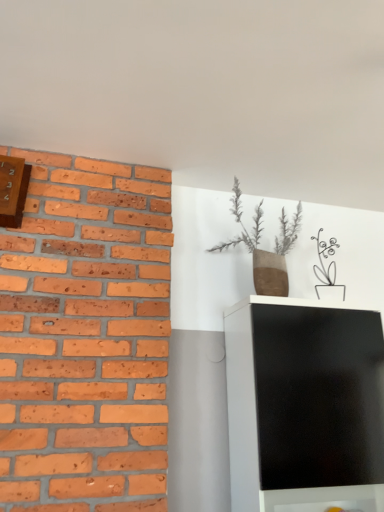
This screenshot has height=512, width=384. What do you see at coordinates (263, 250) in the screenshot?
I see `brown textured vase at upper center` at bounding box center [263, 250].

In order to click on brown textured vase at upper center in this screenshot , I will do `click(263, 250)`.

The height and width of the screenshot is (512, 384). I want to click on wooden clock at upper left, so point(13,190).

What is the approximate width of wooden clock at upper left?

The width of wooden clock at upper left is 3.53 inches.

This screenshot has width=384, height=512. Describe the element at coordinates (13, 190) in the screenshot. I see `wooden clock at upper left` at that location.

What are the coordinates of `brown textured vase at upper center` in the screenshot? It's located at (263, 250).

Which object is positioned more to the left, wooden clock at upper left or brown textured vase at upper center?

Positioned to the left is wooden clock at upper left.

Which object is further away from the camera, wooden clock at upper left or brown textured vase at upper center?

brown textured vase at upper center is further from the camera.

Based on the photo, which point is more distant from viewer, (6, 200) or (250, 241)?

Positioned behind is point (250, 241).

From the image's perspective, is wooden clock at upper left located beneath brown textured vase at upper center?

No, from the image's perspective, wooden clock at upper left is not beneath brown textured vase at upper center.

From a real-world perspective, is wooden clock at upper left under brown textured vase at upper center?

Incorrect, from a real-world perspective, wooden clock at upper left is higher than brown textured vase at upper center.

Considering the sizes of objects wooden clock at upper left and brown textured vase at upper center in the image provided, who is thinner, wooden clock at upper left or brown textured vase at upper center?

Thinner between the two is wooden clock at upper left.

From their relative heights in the image, would you say wooden clock at upper left is taller or shorter than brown textured vase at upper center?

Clearly, wooden clock at upper left is shorter compared to brown textured vase at upper center.

Can you confirm if wooden clock at upper left is bigger than brown textured vase at upper center?

Actually, wooden clock at upper left might be smaller than brown textured vase at upper center.

Is wooden clock at upper left spatially inside brown textured vase at upper center, or outside of it?

wooden clock at upper left is outside brown textured vase at upper center.

Are wooden clock at upper left and brown textured vase at upper center making contact?

No, wooden clock at upper left is not touching brown textured vase at upper center.

Could you tell me if wooden clock at upper left is turned towards brown textured vase at upper center?

No, wooden clock at upper left does not turn towards brown textured vase at upper center.

How distant is wooden clock at upper left from brown textured vase at upper center?

They are 3.39 feet apart.

Locate an element on the screen. clock above the brown textured vase at upper center (from the image's perspective) is located at coordinates (13, 190).

Considering the relative positions of brown textured vase at upper center and wooden clock at upper left in the image provided, is brown textured vase at upper center to the left of wooden clock at upper left from the viewer's perspective?

No.

Is the depth of brown textured vase at upper center greater than that of wooden clock at upper left?

That is True.

Which is nearer, [277,261] or [0,159]?

Point [277,261] is farther from the camera than point [0,159].

From the image's perspective, would you say brown textured vase at upper center is shown under wooden clock at upper left?

Yes, from the image's perspective, brown textured vase at upper center is beneath wooden clock at upper left.

From a real-world perspective, which is physically above, brown textured vase at upper center or wooden clock at upper left?

wooden clock at upper left, from a real-world perspective.

Which object is wider, brown textured vase at upper center or wooden clock at upper left?

With larger width is brown textured vase at upper center.

Can you confirm if brown textured vase at upper center is shorter than wooden clock at upper left?

No.

In terms of size, does brown textured vase at upper center appear bigger or smaller than wooden clock at upper left?

Considering their sizes, brown textured vase at upper center takes up more space than wooden clock at upper left.

Is brown textured vase at upper center outside of wooden clock at upper left?

Result: Absolutely, brown textured vase at upper center is external to wooden clock at upper left.

Are brown textured vase at upper center and wooden clock at upper left located far from each other?

That's right, there is a large distance between brown textured vase at upper center and wooden clock at upper left.

Could you tell me if brown textured vase at upper center is turned towards wooden clock at upper left?

No, brown textured vase at upper center does not turn towards wooden clock at upper left.

Locate an element on the screen. The image size is (384, 512). clock above the brown textured vase at upper center (from the image's perspective) is located at coordinates (13, 190).

Locate an element on the screen. clock in front of the brown textured vase at upper center is located at coordinates (13, 190).

Identify the location of clock above the brown textured vase at upper center (from a real-world perspective). (13, 190).